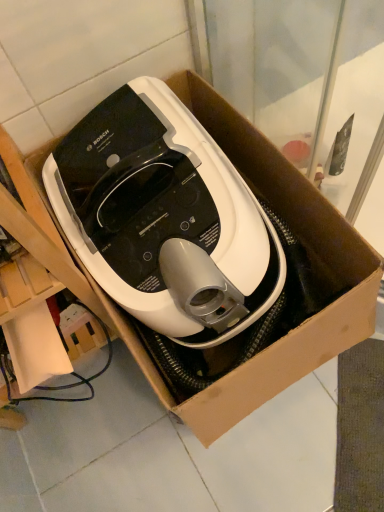
What is the approximate width of white cardboard box at center?

26.11 inches.

The height and width of the screenshot is (512, 384). What do you see at coordinates (286, 284) in the screenshot? I see `white cardboard box at center` at bounding box center [286, 284].

This screenshot has width=384, height=512. In order to click on white cardboard box at center in this screenshot , I will do `click(286, 284)`.

You are a GUI agent. You are given a task and a screenshot of the screen. Output one action in this format:
    pyautogui.click(x=<x>, y=<y>)
    Task: Click on the white cardboard box at center
    The height and width of the screenshot is (512, 384).
    Given the screenshot: What is the action you would take?
    pyautogui.click(x=286, y=284)